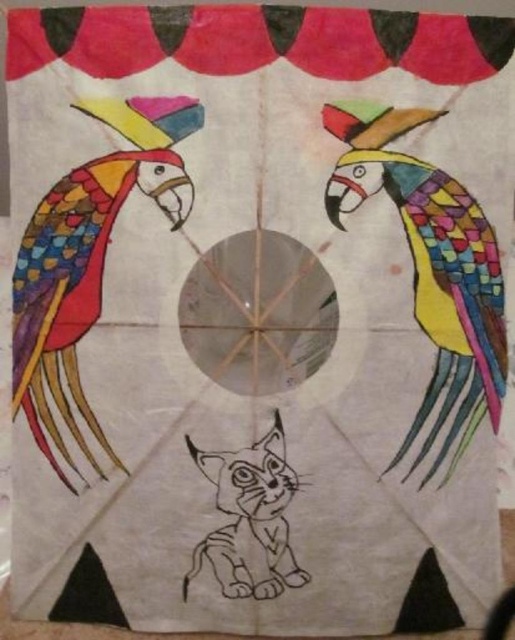
Question: Can you confirm if multicolored mosaic parrot at center is positioned to the right of multicolored paper parrot at left?

Choices:
 (A) yes
 (B) no

Answer: (A)

Question: Is multicolored mosaic parrot at center positioned before multicolored paper parrot at left?

Choices:
 (A) no
 (B) yes

Answer: (B)

Question: Can you confirm if multicolored mosaic parrot at center is wider than multicolored paper parrot at left?

Choices:
 (A) no
 (B) yes

Answer: (B)